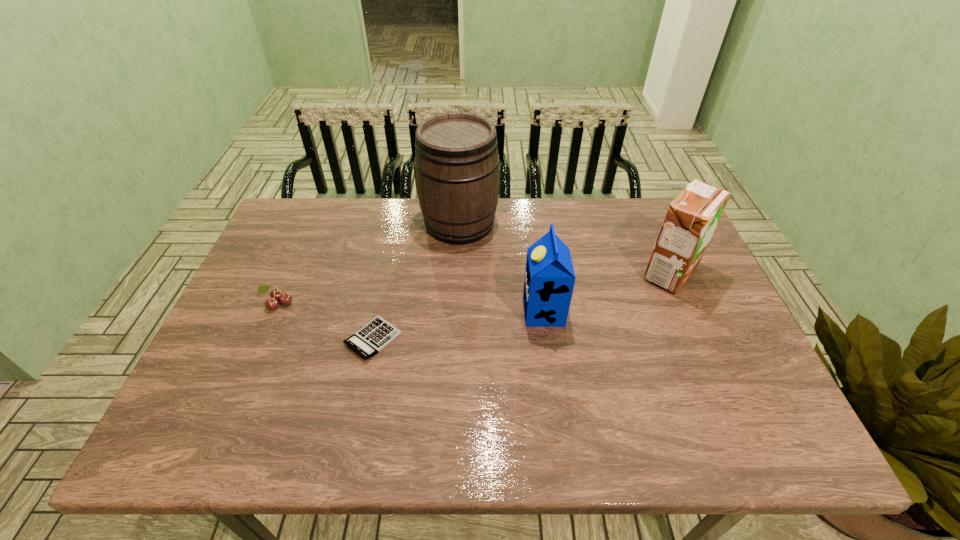
This screenshot has width=960, height=540. Identify the location of the farthest object. (456, 153).

Locate an element on the screen. This screenshot has width=960, height=540. the third object from left to right is located at coordinates (456, 153).

The width and height of the screenshot is (960, 540). Find the location of `the farther carton`. the farther carton is located at coordinates (692, 217).

Locate an element on the screen. This screenshot has width=960, height=540. the rightmost object is located at coordinates coord(692,217).

Image resolution: width=960 pixels, height=540 pixels. In order to click on the left carton in this screenshot , I will do `click(549, 281)`.

Where is `the fourth object from left to right`? The width and height of the screenshot is (960, 540). the fourth object from left to right is located at coordinates (549, 281).

I want to click on cherry, so click(276, 294).

The height and width of the screenshot is (540, 960). In order to click on the fourth tallest object in this screenshot , I will do `click(276, 294)`.

The image size is (960, 540). I want to click on calculator, so click(378, 333).

The height and width of the screenshot is (540, 960). In order to click on the fourth object from right to left in this screenshot , I will do `click(378, 333)`.